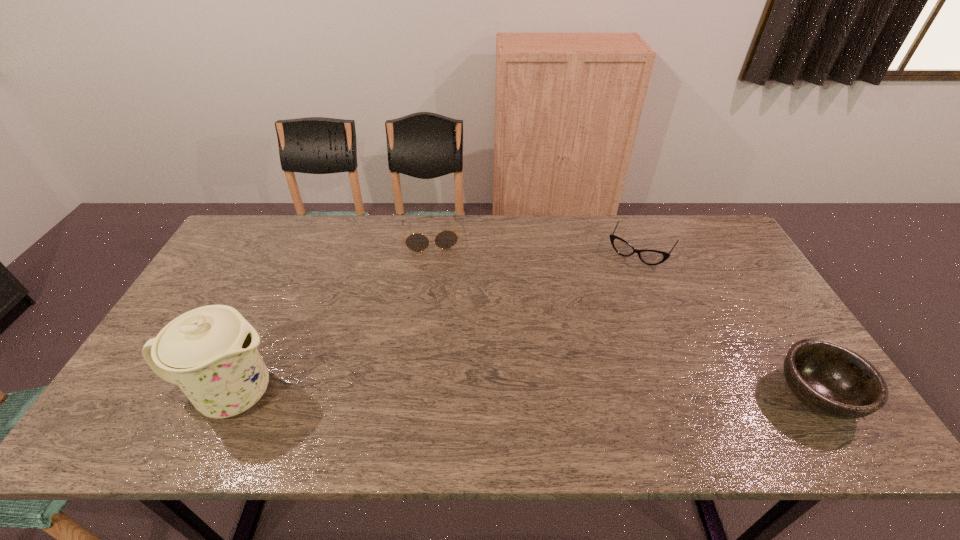
What are the coordinates of `free space located on the front-facing side of the spectacles` in the screenshot? It's located at (612, 294).

You are a GUI agent. You are given a task and a screenshot of the screen. Output one action in this format:
    pyautogui.click(x=<x>, y=<y>)
    Task: Click on the vacant space situated 0.330m on the lenses of the sunglasses
    
    Given the screenshot: What is the action you would take?
    pyautogui.click(x=444, y=328)

Identify the location of vacant space positioned 0.170m on the lenses of the sunglasses. (439, 288).

The height and width of the screenshot is (540, 960). I want to click on vacant space located on the lenses of the sunglasses, so click(437, 276).

Find the location of `spectacles that is at the far edge`. spectacles that is at the far edge is located at coordinates (650, 257).

Find the location of a particular element. sunglasses present at the far edge is located at coordinates (417, 242).

What are the coordinates of `chinaware situated at the near edge` in the screenshot? It's located at (210, 352).

In order to click on bowl present at the near edge in this screenshot , I will do `click(833, 380)`.

Image resolution: width=960 pixels, height=540 pixels. What are the coordinates of `object that is at the left edge` in the screenshot? It's located at (210, 352).

At what (x,y) coordinates should I click in order to perform the action: click on object that is at the right edge. Please return your answer as a coordinate pair (x, y). The height and width of the screenshot is (540, 960). Looking at the image, I should click on (833, 380).